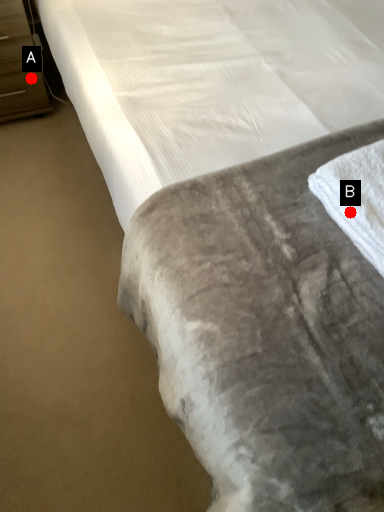
Question: Two points are circled on the image, labeled by A and B beside each circle. Which point appears farthest from the camera in this image?

Choices:
 (A) A is further
 (B) B is further

Answer: (A)